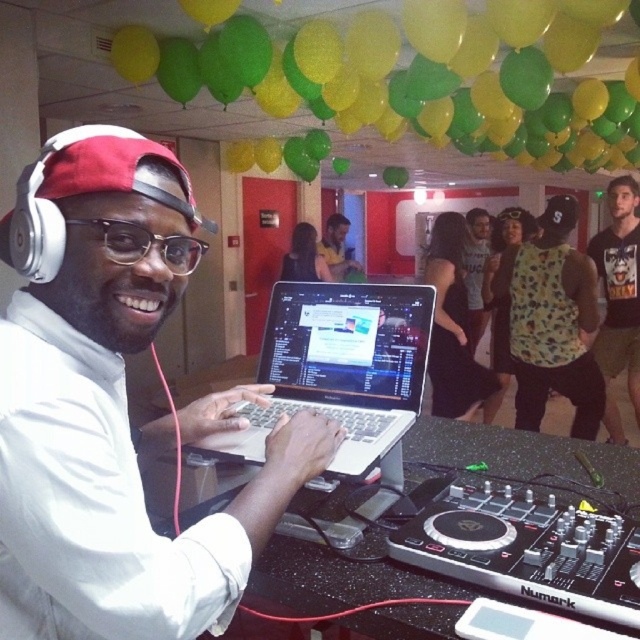
You are a guest at the party and want to take a photo of the silver metallic laptop at center. Where should you stand to capture it in the best possible angle?

The silver metallic laptop at center is located at point (339,368), so you should position yourself directly in front of that coordinate to capture it at the best angle.

You are a guest at the party and want to know if the white matte headphones at upper left can be placed on top of the matte black laptop at center without falling off. Based on their thickness, can they be stacked?

The white matte headphones at upper left is thinner than the matte black laptop at center, so they can be placed on top without exceeding the laptop surface area and should remain stable.